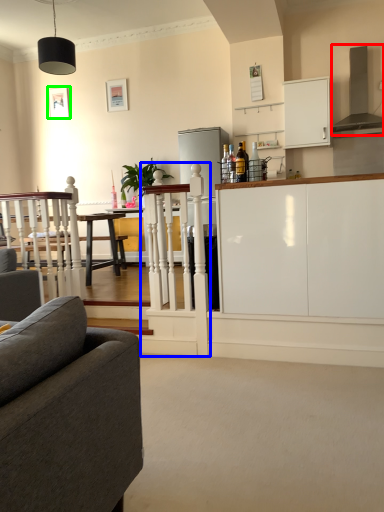
Question: Which object is positioned farthest from exhaust hood (highlighted by a red box)? Select from rail (highlighted by a blue box) and picture frame (highlighted by a green box).

Choices:
 (A) rail
 (B) picture frame

Answer: (B)